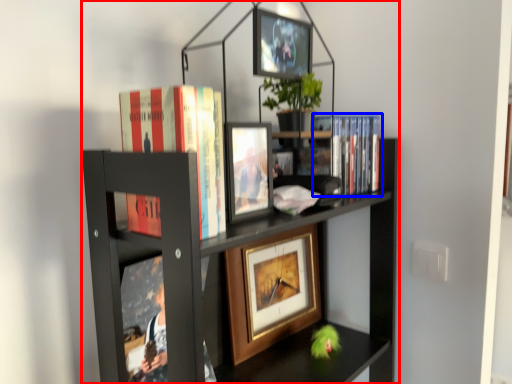
Question: Among these objects, which one is farthest to the camera, bookcase (highlighted by a red box) or book (highlighted by a blue box)?

Choices:
 (A) bookcase
 (B) book

Answer: (B)